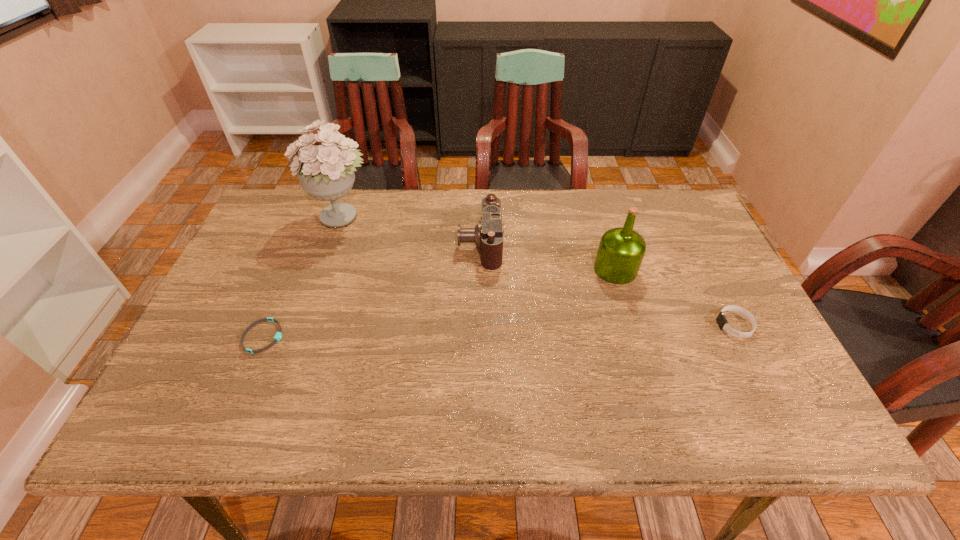
Where is `the tallest object`? The image size is (960, 540). the tallest object is located at coordinates (326, 172).

The image size is (960, 540). Identify the location of the second tallest object. (621, 250).

You are a GUI agent. You are given a task and a screenshot of the screen. Output one action in this format:
    pyautogui.click(x=<x>, y=<y>)
    Task: Click on the fourth object from left to right
    This screenshot has height=540, width=960.
    Given the screenshot: What is the action you would take?
    pyautogui.click(x=621, y=250)

Where is `the third object from right to left`? The width and height of the screenshot is (960, 540). the third object from right to left is located at coordinates (488, 235).

Where is `camera`? The width and height of the screenshot is (960, 540). camera is located at coordinates (488, 235).

Where is `the taller wristband`? The image size is (960, 540). the taller wristband is located at coordinates (722, 322).

Locate an element on the screen. the right wristband is located at coordinates (722, 322).

This screenshot has width=960, height=540. I want to click on the shortest object, so click(278, 335).

Find the location of a particular element. This screenshot has height=540, width=960. the left wristband is located at coordinates (278, 335).

Find the location of a particular element. This screenshot has height=540, width=960. vacant area situated on the front of the tallest object is located at coordinates (322, 275).